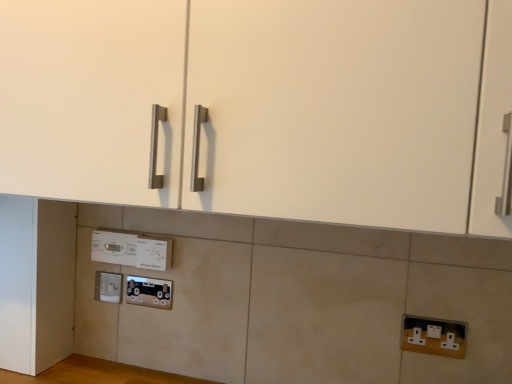
Question: Is metallic socket at lower center bigger than white plastic thermostat at center?

Choices:
 (A) yes
 (B) no

Answer: (B)

Question: Considering the relative sizes of metallic socket at lower center and white plastic thermostat at center in the image provided, is metallic socket at lower center wider than white plastic thermostat at center?

Choices:
 (A) yes
 (B) no

Answer: (B)

Question: Can you confirm if metallic socket at lower center is smaller than white plastic thermostat at center?

Choices:
 (A) no
 (B) yes

Answer: (B)

Question: Is the depth of metallic socket at lower center less than that of white plastic thermostat at center?

Choices:
 (A) yes
 (B) no

Answer: (B)

Question: Is white plastic thermostat at center at the back of metallic socket at lower center?

Choices:
 (A) yes
 (B) no

Answer: (B)

Question: Is white plastic thermostat at center spatially inside white matte door at lower left, or outside of it?

Choices:
 (A) inside
 (B) outside

Answer: (B)

Question: Would you say white plastic thermostat at center is to the left or to the right of white matte door at lower left in the picture?

Choices:
 (A) left
 (B) right

Answer: (B)

Question: Looking at their shapes, would you say white plastic thermostat at center is wider or thinner than white matte door at lower left?

Choices:
 (A) wide
 (B) thin

Answer: (B)

Question: In terms of size, does white plastic thermostat at center appear bigger or smaller than white matte door at lower left?

Choices:
 (A) big
 (B) small

Answer: (B)

Question: From a real-world perspective, is white matte door at lower left above or below white plastic electric outlet at lower left, which is counted as the 2th electric outlet, starting from the top?

Choices:
 (A) below
 (B) above

Answer: (B)

Question: Considering the positions of point coord(27,273) and point coord(119,284), is point coord(27,273) closer or farther from the camera than point coord(119,284)?

Choices:
 (A) farther
 (B) closer

Answer: (B)

Question: From the image's perspective, is white matte door at lower left above or below white plastic electric outlet at lower left, which is counted as the 2th electric outlet, starting from the top?

Choices:
 (A) above
 (B) below

Answer: (A)

Question: Is white matte door at lower left taller or shorter than white plastic electric outlet at lower left, which is the 1th electric outlet in left-to-right order?

Choices:
 (A) tall
 (B) short

Answer: (A)

Question: From a real-world perspective, is white plastic thermostat at center positioned above or below metallic socket at lower center?

Choices:
 (A) below
 (B) above

Answer: (B)

Question: In terms of height, does white plastic thermostat at center look taller or shorter compared to metallic socket at lower center?

Choices:
 (A) tall
 (B) short

Answer: (A)